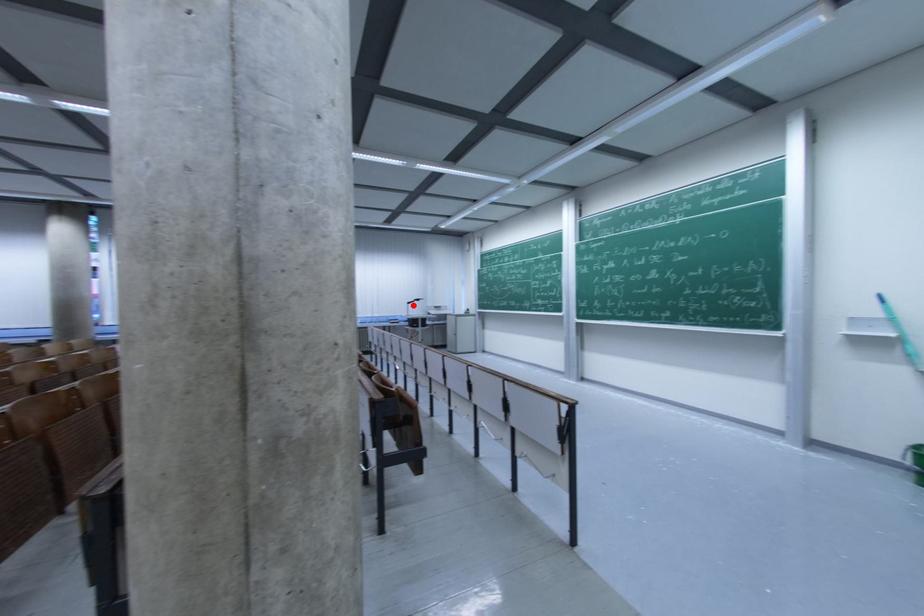
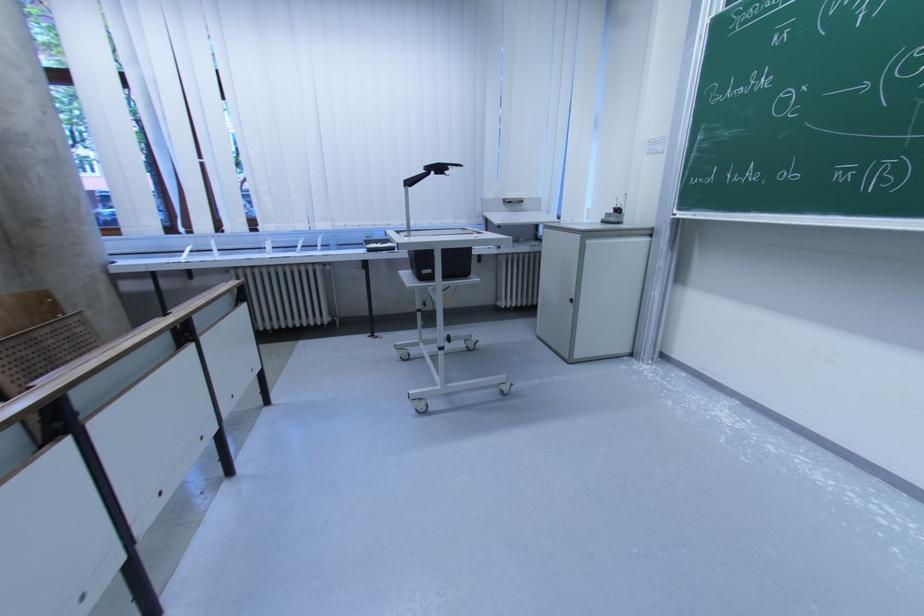
Question: I am providing you with two images of the same scene from different viewpoints. In image1, a red point is highlighted. Considering the same 3D point in image2, which of the following is correct?

Choices:
 (A) It is closer
 (B) It is farther

Answer: (A)